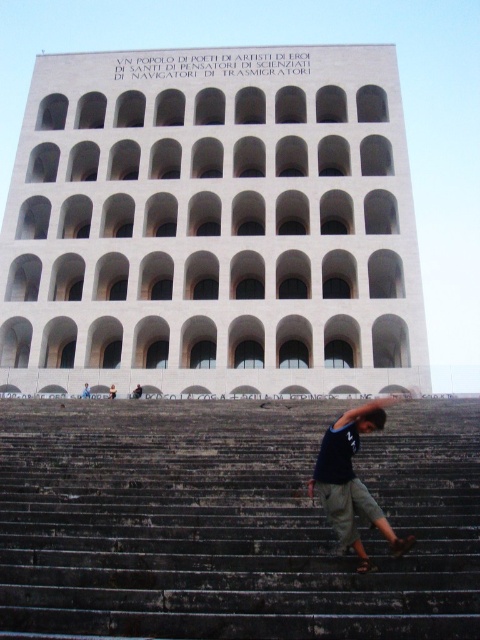
Is dark gray concrete stairs at center smaller than dark blue shirt at lower center?

Incorrect, dark gray concrete stairs at center is not smaller in size than dark blue shirt at lower center.

Can you confirm if dark gray concrete stairs at center is bigger than dark blue shirt at lower center?

Yes.

This screenshot has width=480, height=640. Describe the element at coordinates (230, 522) in the screenshot. I see `dark gray concrete stairs at center` at that location.

Locate an element on the screen. This screenshot has width=480, height=640. dark gray concrete stairs at center is located at coordinates (230, 522).

Is point (245, 627) positioned before point (355, 532)?

Yes.

Who is more distant from viewer, [381,625] or [332,488]?

The point [332,488] is behind.

Find the location of a particular element. The image size is (480, 640). dark gray concrete stairs at center is located at coordinates (230, 522).

Who is more forward, (352, 436) or (110, 396)?

Positioned in front is point (352, 436).

Can you confirm if dark blue t-shirt at center is taller than dark blue shirt at lower center?

Yes.

Locate an element on the screen. dark blue t-shirt at center is located at coordinates (351, 480).

Image resolution: width=480 pixels, height=640 pixels. In order to click on dark blue t-shirt at center in this screenshot , I will do `click(351, 480)`.